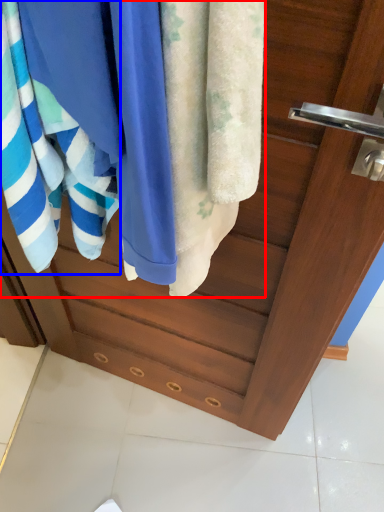
Question: Among these objects, which one is farthest to the camera, beach towel (highlighted by a red box) or towel (highlighted by a blue box)?

Choices:
 (A) beach towel
 (B) towel

Answer: (A)